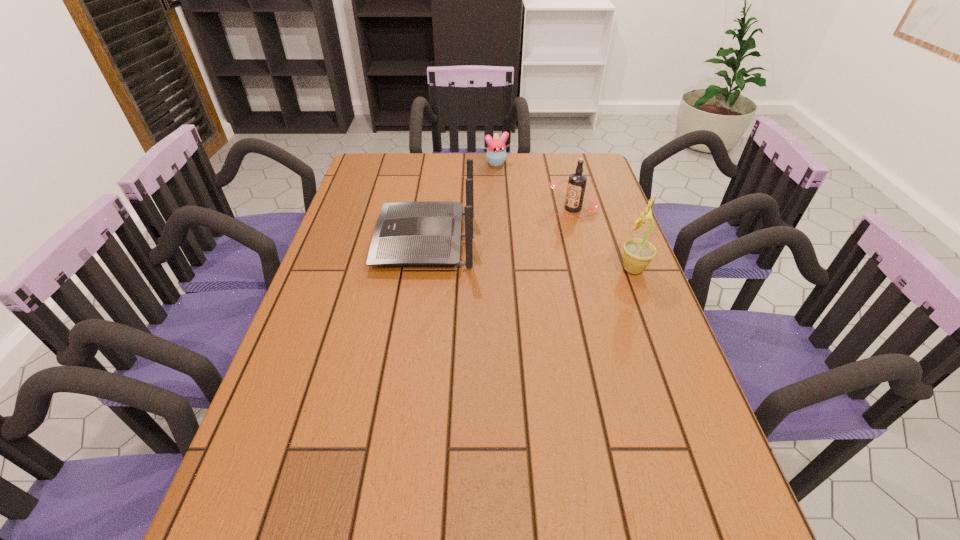
The height and width of the screenshot is (540, 960). I want to click on root beer at the right edge, so click(577, 181).

In the image, there is a desktop. At what (x,y) coordinates should I click in order to perform the action: click on vacant space at the far edge. Please return your answer as a coordinate pair (x, y). This screenshot has width=960, height=540. Looking at the image, I should click on (453, 176).

This screenshot has height=540, width=960. I want to click on free space at the left edge of the desktop, so click(328, 286).

In the image, there is a desktop. Identify the location of vacant space at the right edge. (616, 285).

This screenshot has height=540, width=960. In order to click on vacant space at the far left corner of the desktop in this screenshot , I will do click(x=366, y=157).

This screenshot has width=960, height=540. In the image, there is a desktop. Find the location of `blank space at the far right corner`. blank space at the far right corner is located at coordinates (575, 169).

This screenshot has width=960, height=540. Find the location of `free spot between the router and the cupcake`. free spot between the router and the cupcake is located at coordinates (461, 202).

The width and height of the screenshot is (960, 540). Find the location of `free area in between the router and the sunflower`. free area in between the router and the sunflower is located at coordinates (529, 255).

Image resolution: width=960 pixels, height=540 pixels. Find the location of `empty location between the cupcake and the sunflower`. empty location between the cupcake and the sunflower is located at coordinates (564, 216).

Locate an element on the screen. The height and width of the screenshot is (540, 960). vacant area that lies between the leftmost object and the sunflower is located at coordinates tap(529, 255).